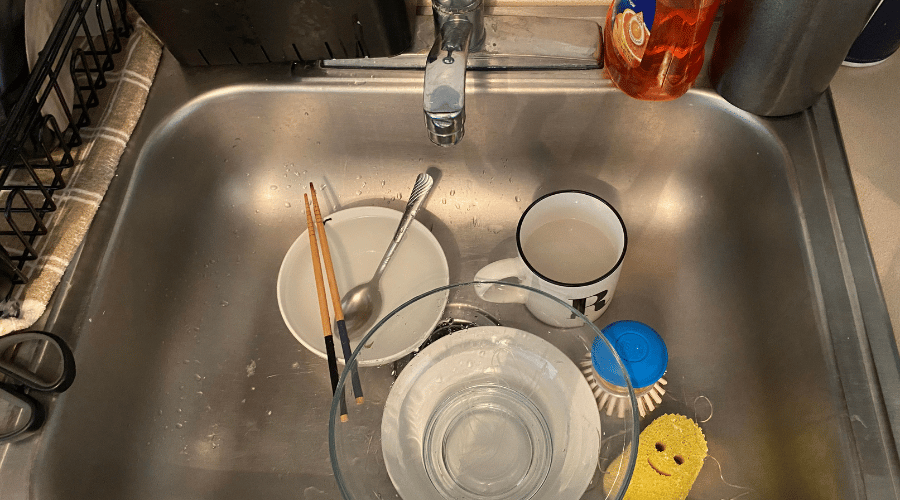
Where is `dish soap`? This screenshot has height=500, width=900. dish soap is located at coordinates (685, 43).